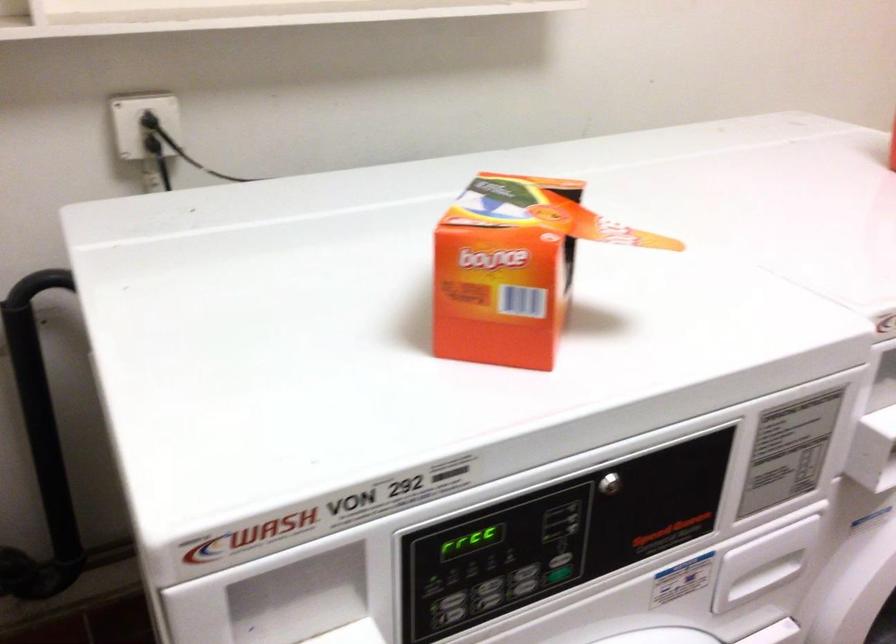
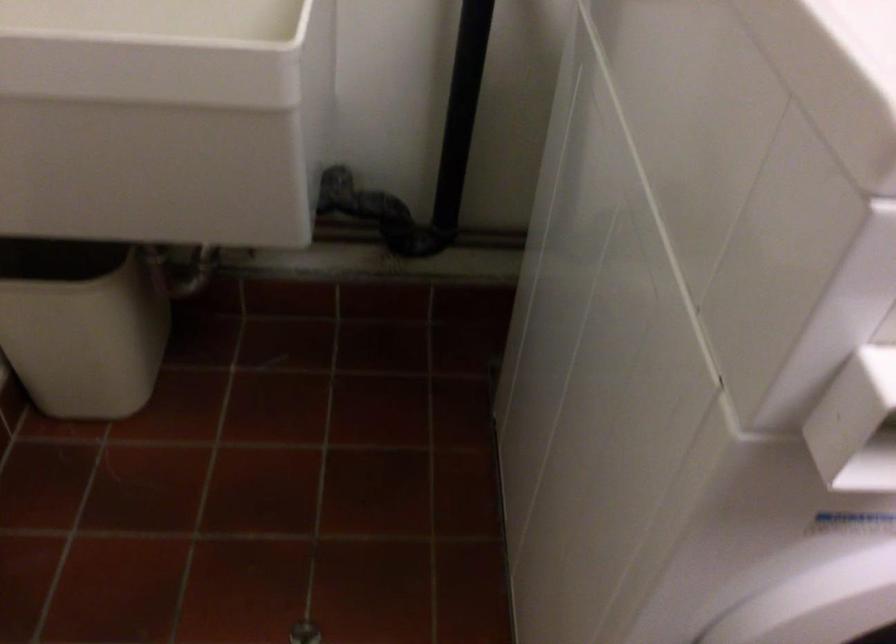
The images are taken continuously from a first-person perspective. In which direction is your viewpoint rotating?

The camera rotated toward left-down.